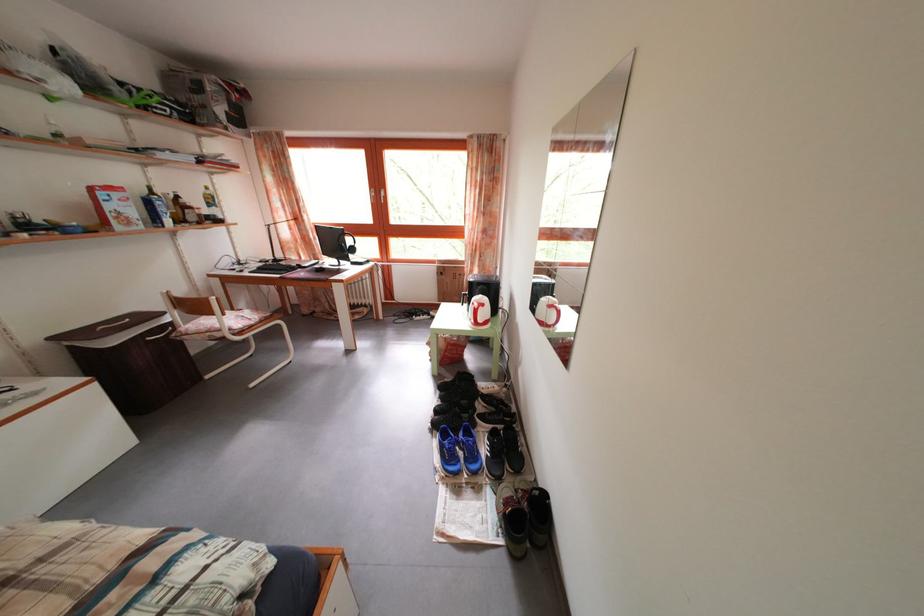
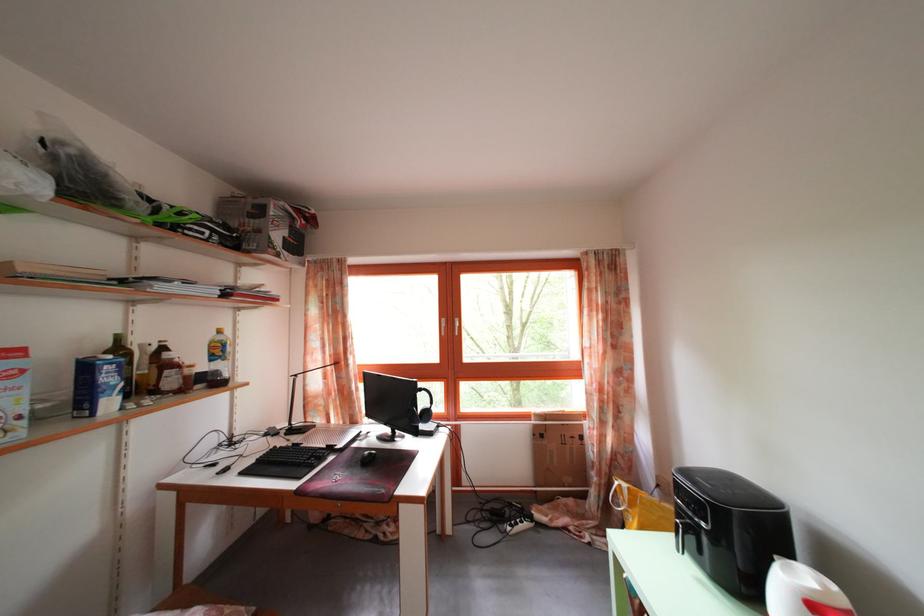
In the second image, find the point that corresponds to point (323, 274) in the first image.

(363, 451)